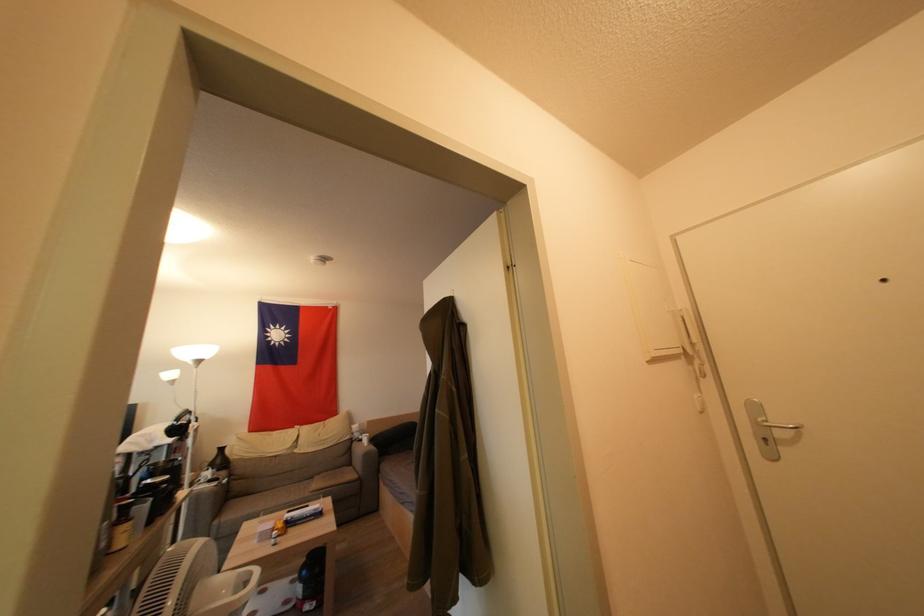
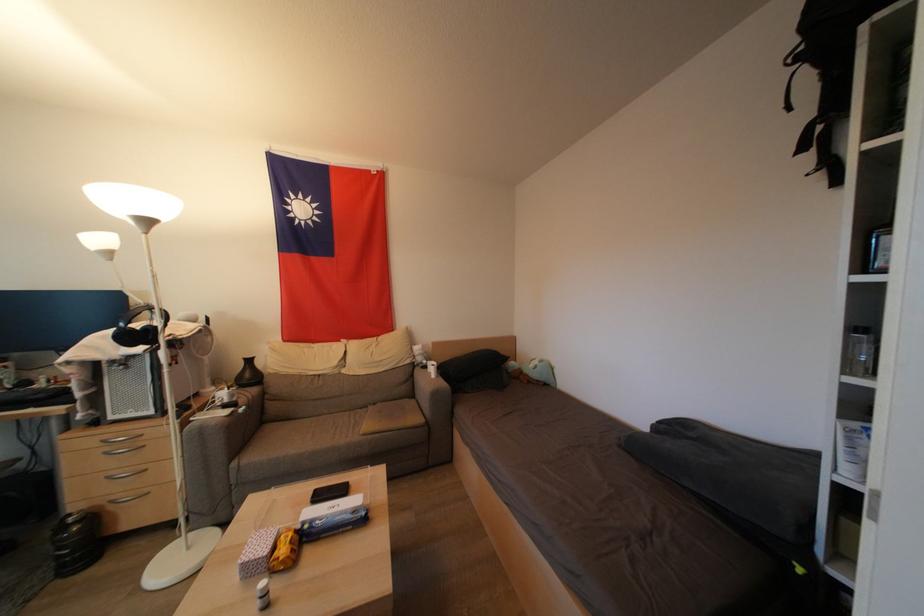
Question: I am providing you with two images of the same scene from different viewpoints. Which of the following objects are not visible in image2?

Choices:
 (A) drawer handle
 (B) blue wet wipes package
 (C) glass jar
 (D) none of these

Answer: (D)